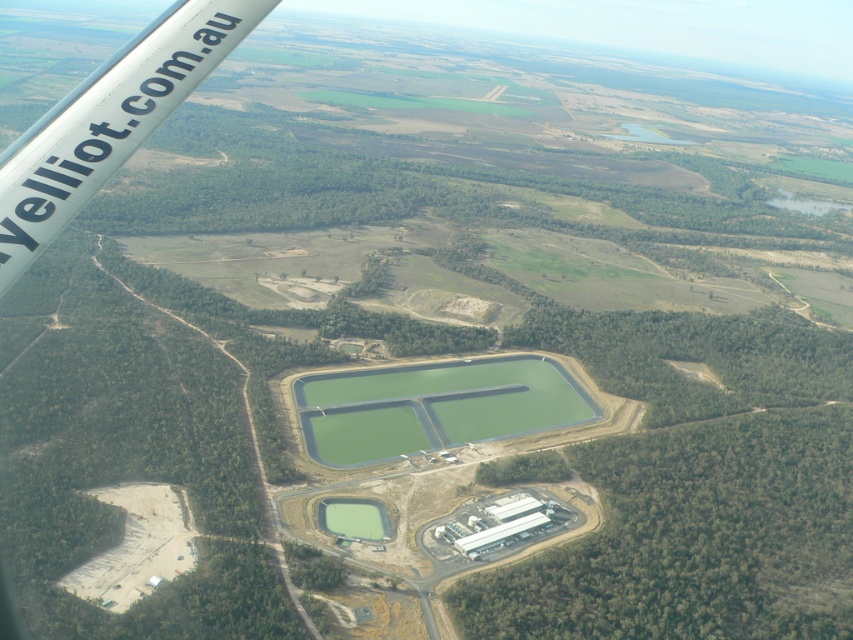
Question: Which point is closer to the camera?

Choices:
 (A) pos(354,508)
 (B) pos(24,177)
 (C) pos(403,413)

Answer: (B)

Question: Is the position of white glossy wing at upper left more distant than that of green liquid at center?

Choices:
 (A) no
 (B) yes

Answer: (A)

Question: Considering the relative positions of white glossy wing at upper left and green concrete water at center in the image provided, where is white glossy wing at upper left located with respect to green concrete water at center?

Choices:
 (A) right
 (B) left

Answer: (B)

Question: Is white glossy wing at upper left positioned at the back of green liquid at center?

Choices:
 (A) yes
 (B) no

Answer: (B)

Question: Among these points, which one is nearest to the camera?

Choices:
 (A) (83, 118)
 (B) (380, 512)
 (C) (419, 410)

Answer: (A)

Question: Which object is closer to the camera taking this photo?

Choices:
 (A) white glossy wing at upper left
 (B) green concrete water at center

Answer: (A)